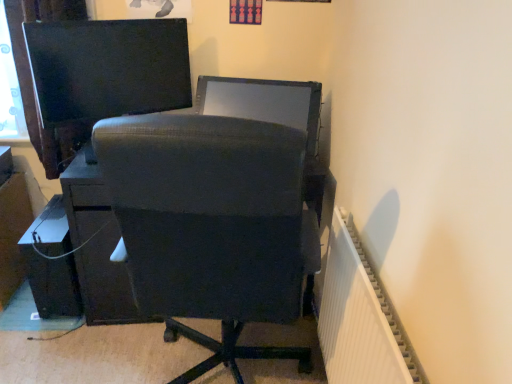
Question: From the image's perspective, is matte black file cabinet at lower left on matte black monitor at upper left, which ranks as the 1th computer monitor in left-to-right order?

Choices:
 (A) yes
 (B) no

Answer: (B)

Question: Is matte black file cabinet at lower left positioned in front of matte black monitor at upper left, which ranks as the 1th computer monitor in left-to-right order?

Choices:
 (A) yes
 (B) no

Answer: (B)

Question: Is matte black file cabinet at lower left touching matte black monitor at upper left, which appears as the 2th computer monitor when viewed from the right?

Choices:
 (A) yes
 (B) no

Answer: (B)

Question: Does matte black file cabinet at lower left have a greater height compared to matte black monitor at upper left, which appears as the 2th computer monitor when viewed from the right?

Choices:
 (A) yes
 (B) no

Answer: (A)

Question: Can you confirm if matte black file cabinet at lower left is bigger than matte black monitor at upper left, which ranks as the 1th computer monitor in left-to-right order?

Choices:
 (A) no
 (B) yes

Answer: (A)

Question: From the image's perspective, is matte black file cabinet at lower left above or below matte black chair at center?

Choices:
 (A) below
 (B) above

Answer: (B)

Question: From a real-world perspective, relative to matte black chair at center, is matte black file cabinet at lower left vertically above or below?

Choices:
 (A) above
 (B) below

Answer: (B)

Question: Is matte black file cabinet at lower left taller or shorter than matte black chair at center?

Choices:
 (A) tall
 (B) short

Answer: (B)

Question: Based on their positions, is matte black file cabinet at lower left located to the left or right of matte black chair at center?

Choices:
 (A) right
 (B) left

Answer: (B)

Question: Based on their sizes in the image, would you say white ribbed radiator at right is bigger or smaller than matte black chair at center?

Choices:
 (A) big
 (B) small

Answer: (B)

Question: Is point (332, 334) positioned closer to the camera than point (195, 279)?

Choices:
 (A) closer
 (B) farther

Answer: (B)

Question: From the image's perspective, is white ribbed radiator at right above or below matte black chair at center?

Choices:
 (A) above
 (B) below

Answer: (B)

Question: Choose the correct answer: Is white ribbed radiator at right inside matte black chair at center or outside it?

Choices:
 (A) inside
 (B) outside

Answer: (B)

Question: Visually, is matte black cable at lower left positioned to the left or to the right of satin black monitor at center, which is counted as the 1th computer monitor, starting from the right?

Choices:
 (A) left
 (B) right

Answer: (A)

Question: Is matte black cable at lower left situated inside satin black monitor at center, the second computer monitor in the left-to-right sequence, or outside?

Choices:
 (A) outside
 (B) inside

Answer: (A)